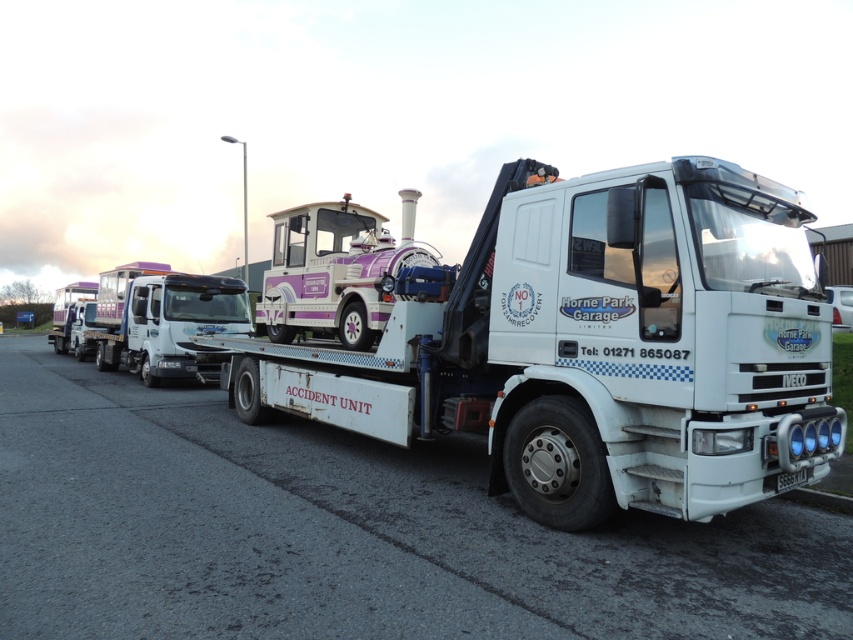
You are a tow truck operator who needs to secure the purple glossy steam engine at center on the flatbed. Based on its position coordinates, is it centered on the flatbed?

The purple glossy steam engine at center is located at point coordinates (335, 269), which is slightly offset from the exact center. Therefore, it is not perfectly centered on the flatbed.

You are a delivery driver who needs to unload a package from the purple glossy steam engine at center to the black plastic license plate at center. Can you place the package on the license plate without moving the engine?

The purple glossy steam engine at center is positioned on the left side of black plastic license plate at center, so yes, you can place the package on the license plate without moving the engine since it is to the right of the engine.